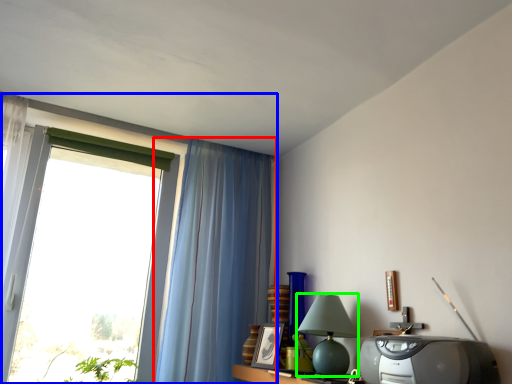
Question: Considering the real-world distances, which object is closest to curtain (highlighted by a red box)? window (highlighted by a blue box) or table lamp (highlighted by a green box).

Choices:
 (A) window
 (B) table lamp

Answer: (A)